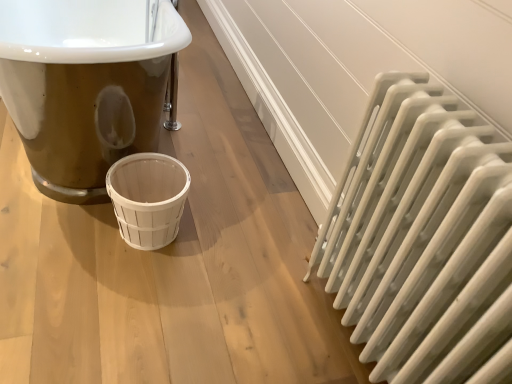
Question: Does white wood basket at center touch white matte radiator at right?

Choices:
 (A) no
 (B) yes

Answer: (A)

Question: Does white wood basket at center contain white matte radiator at right?

Choices:
 (A) no
 (B) yes

Answer: (A)

Question: Is white wood basket at center positioned with its back to white matte radiator at right?

Choices:
 (A) yes
 (B) no

Answer: (B)

Question: Is white wood basket at center at the right side of white matte radiator at right?

Choices:
 (A) yes
 (B) no

Answer: (B)

Question: From the image's perspective, is white wood basket at center located above white matte radiator at right?

Choices:
 (A) yes
 (B) no

Answer: (A)

Question: Could you tell me if white wood basket at center is facing white matte radiator at right?

Choices:
 (A) yes
 (B) no

Answer: (B)

Question: Is white matte radiator at right not inside white wood basket at center?

Choices:
 (A) yes
 (B) no

Answer: (A)

Question: Could you tell me if white matte radiator at right is turned towards white wood basket at center?

Choices:
 (A) yes
 (B) no

Answer: (B)

Question: From a real-world perspective, is white matte radiator at right under white wood basket at center?

Choices:
 (A) no
 (B) yes

Answer: (A)

Question: Does white matte radiator at right lie behind white wood basket at center?

Choices:
 (A) no
 (B) yes

Answer: (A)

Question: Does white matte radiator at right lie in front of white wood basket at center?

Choices:
 (A) no
 (B) yes

Answer: (B)

Question: Is white matte radiator at right oriented away from white wood basket at center?

Choices:
 (A) yes
 (B) no

Answer: (B)

Question: Considering the positions of white matte radiator at right and white wood basket at center in the image, is white matte radiator at right taller or shorter than white wood basket at center?

Choices:
 (A) tall
 (B) short

Answer: (A)